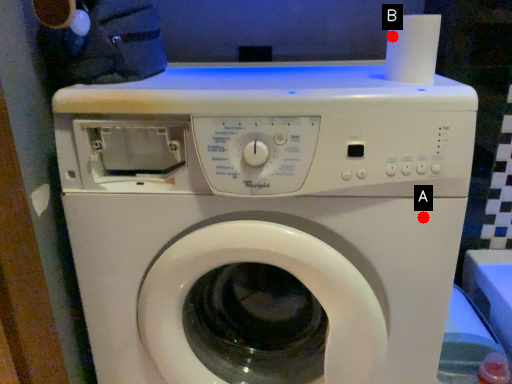
Question: Two points are circled on the image, labeled by A and B beside each circle. Which point appears farthest from the camera in this image?

Choices:
 (A) A is further
 (B) B is further

Answer: (B)